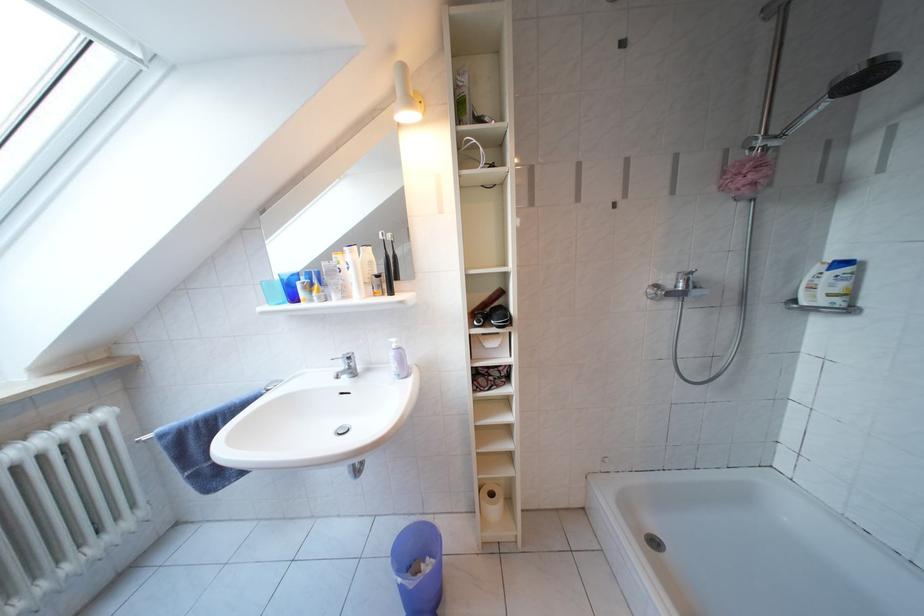
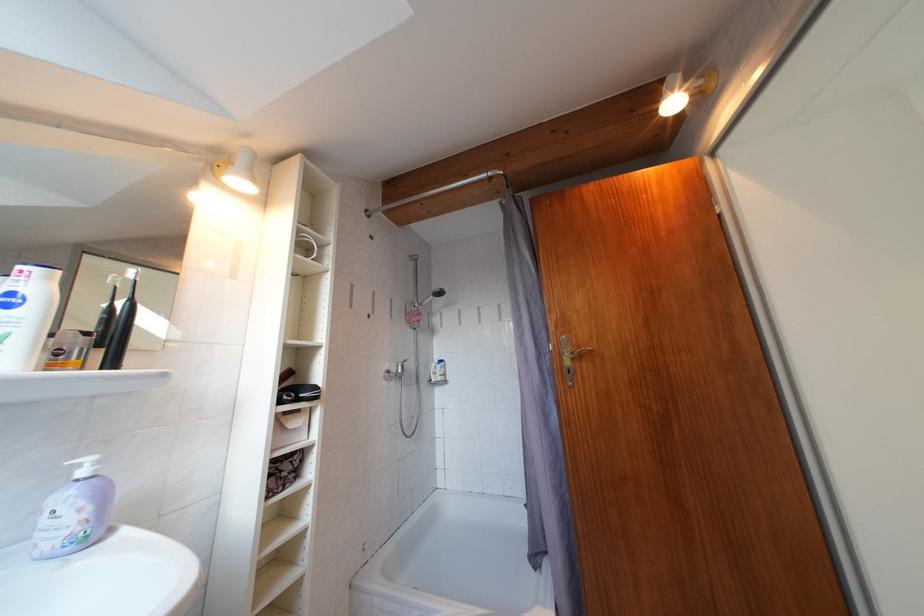
Locate, in the second image, the point that corresponds to point 402,351 in the first image.

(92, 477)